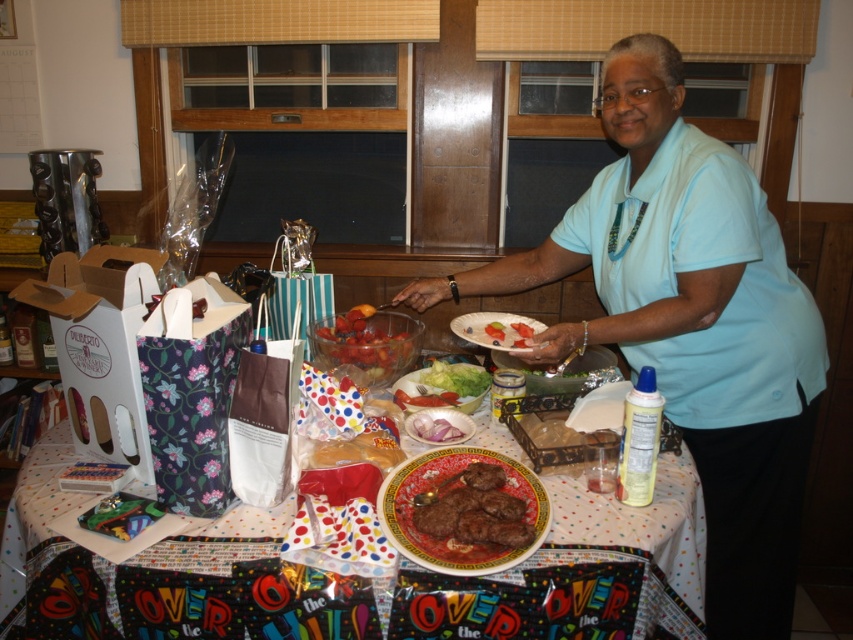
You are a guest at the party and want to grab the pink paper napkin at center to wipe your hands. Can you reach it without moving the shiny plastic bowl at center?

The pink paper napkin at center is behind the shiny plastic bowl at center, so you cannot reach it without moving the shiny plastic bowl at center.

You are taking a photo of the party scene. You want to focus on the two points in the image. Which point is closer to your camera, point (x=326, y=346) or point (x=450, y=372)?

Point (x=326, y=346) is closer to the camera than point (x=450, y=372).